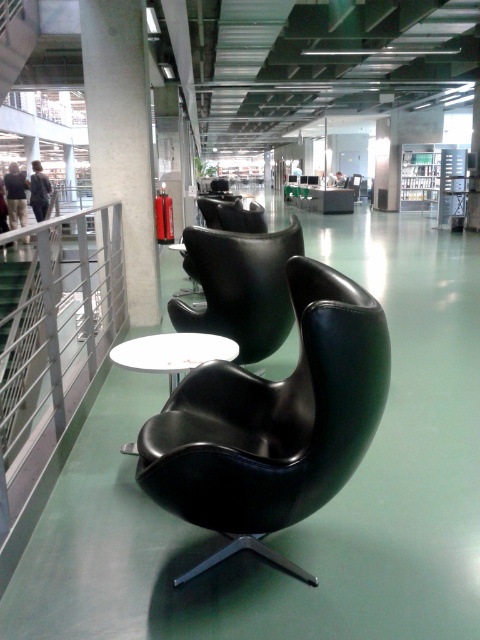
Who is shorter, black leather armchair at center or white glossy round table at center?

With less height is white glossy round table at center.

Does point (218, 310) lie in front of point (162, 369)?

That is False.

Where is `black leather armchair at center`? This screenshot has width=480, height=640. black leather armchair at center is located at coordinates (240, 288).

Can you confirm if matte black swivel chair at center is positioned above black leather armchair at center?

Actually, matte black swivel chair at center is below black leather armchair at center.

Does matte black swivel chair at center appear on the right side of black leather armchair at center?

Yes, matte black swivel chair at center is to the right of black leather armchair at center.

This screenshot has width=480, height=640. Describe the element at coordinates (273, 422) in the screenshot. I see `matte black swivel chair at center` at that location.

This screenshot has width=480, height=640. Identify the location of matte black swivel chair at center. (273, 422).

Between matte black swivel chair at center and white glossy round table at center, which one is positioned higher?

white glossy round table at center is higher up.

Is matte black swivel chair at center bigger than white glossy round table at center?

Yes, matte black swivel chair at center is bigger than white glossy round table at center.

Find the location of a particular element. matte black swivel chair at center is located at coordinates (273, 422).

Locate an element on the screen. matte black swivel chair at center is located at coordinates (273, 422).